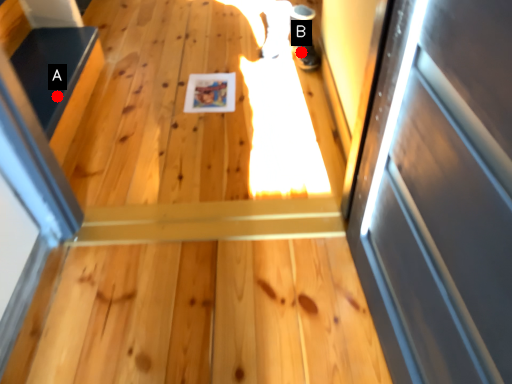
Question: Two points are circled on the image, labeled by A and B beside each circle. Which point is closer to the camera?

Choices:
 (A) A is closer
 (B) B is closer

Answer: (A)